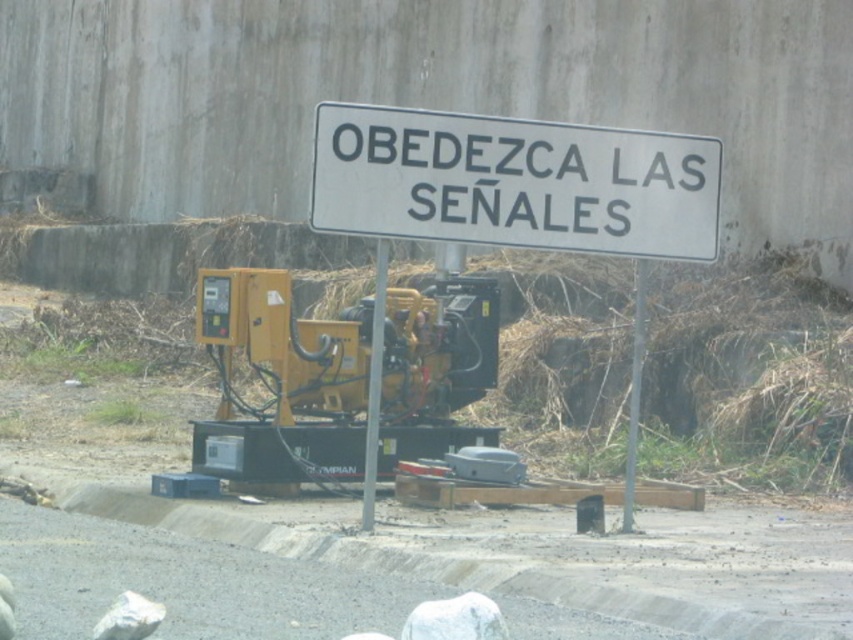
Does white plastic sign at upper center appear on the right side of metallic pole at center?

Incorrect, white plastic sign at upper center is not on the right side of metallic pole at center.

Who is lower down, white plastic sign at upper center or metallic pole at center?

metallic pole at center

At what (x,y) coordinates should I click in order to perform the action: click on white plastic sign at upper center. Please return your answer as a coordinate pair (x, y). The image size is (853, 640). Looking at the image, I should click on (514, 182).

You are a GUI agent. You are given a task and a screenshot of the screen. Output one action in this format:
    pyautogui.click(x=<x>, y=<y>)
    Task: Click on the white plastic sign at upper center
    
    Given the screenshot: What is the action you would take?
    pyautogui.click(x=514, y=182)

Measure the distance between point (376, 308) and camera.

The distance of point (376, 308) from camera is 12.78 meters.

Which is below, yellow metallic generator at center or metallic pole at center?

Positioned lower is yellow metallic generator at center.

Is point (381, 284) behind point (643, 316)?

No, (381, 284) is closer to viewer.

Identify the location of yellow metallic generator at center. This screenshot has width=853, height=640. (374, 387).

Who is shorter, white plastic sign at upper center or yellow metallic generator at center?

With less height is white plastic sign at upper center.

Who is taller, white plastic sign at upper center or yellow metallic generator at center?

yellow metallic generator at center is taller.

The width and height of the screenshot is (853, 640). Find the location of `white plastic sign at upper center`. white plastic sign at upper center is located at coordinates (514, 182).